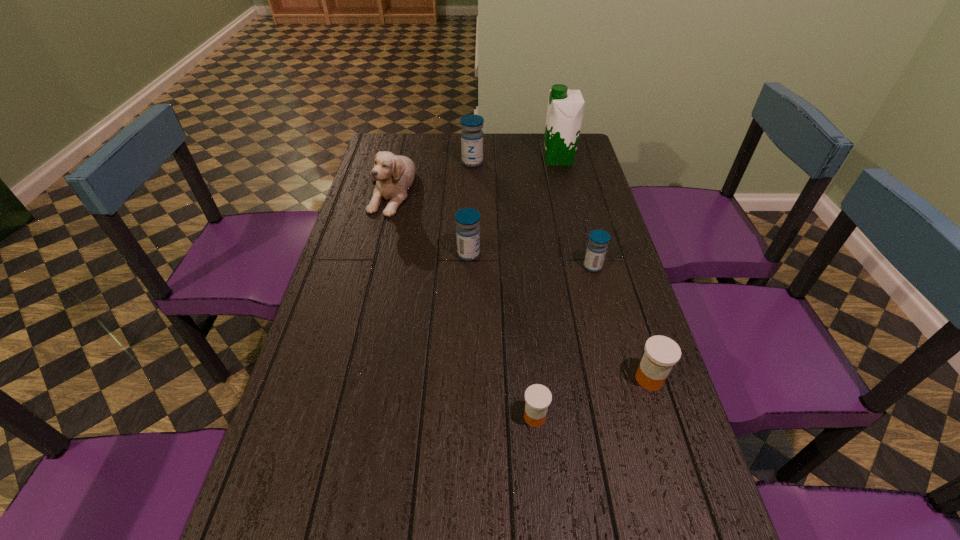
Locate an element on the screen. The height and width of the screenshot is (540, 960). object that is the closest to the shortest medicine is located at coordinates (661, 353).

Select which medicine appears as the third closest to the nearest medicine. Please provide its 2D coordinates. Your answer should be formatted as a tuple, i.e. [(x, y)], where the tuple contains the x and y coordinates of a point satisfying the conditions above.

[(467, 219)]

Identify which medicine is located as the nearest to the second smallest blue medicine. Please provide its 2D coordinates. Your answer should be formatted as a tuple, i.e. [(x, y)], where the tuple contains the x and y coordinates of a point satisfying the conditions above.

[(597, 246)]

Where is `blue medicine that is the second closest to the rightmost blue medicine`? blue medicine that is the second closest to the rightmost blue medicine is located at coordinates (471, 136).

Locate which blue medicine is the closest to the nearest object. Please provide its 2D coordinates. Your answer should be formatted as a tuple, i.e. [(x, y)], where the tuple contains the x and y coordinates of a point satisfying the conditions above.

[(597, 246)]

Where is `vacant space that satisfies the following two spatial constraints: 1. on the front-facing side of the leftmost object; 2. on the left side of the second biggest blue medicine`? This screenshot has width=960, height=540. vacant space that satisfies the following two spatial constraints: 1. on the front-facing side of the leftmost object; 2. on the left side of the second biggest blue medicine is located at coordinates (374, 254).